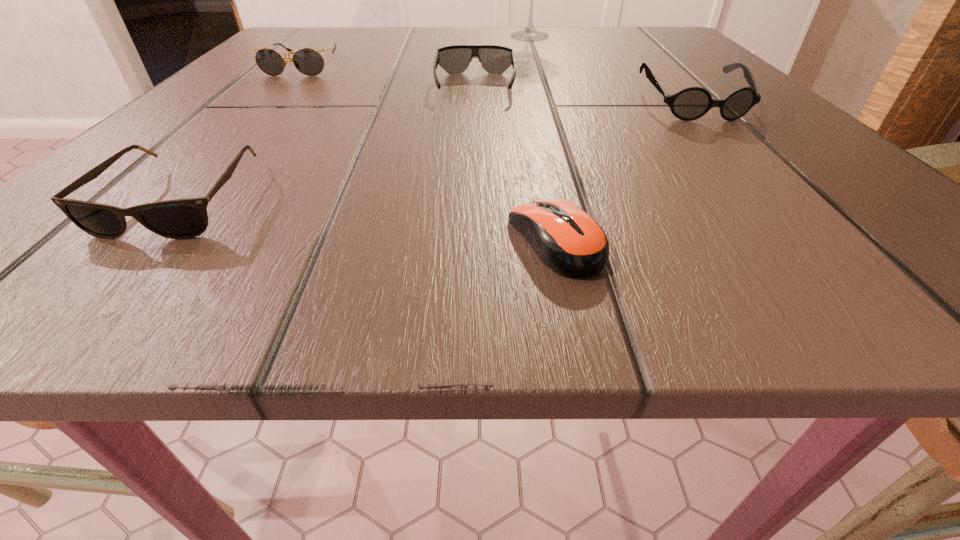
Image resolution: width=960 pixels, height=540 pixels. In order to click on the fourth closest object to the rightmost sunglasses in this screenshot , I will do `click(308, 61)`.

At what (x,y) coordinates should I click in order to perform the action: click on sunglasses that can be found as the third closest to the rightmost object. Please return your answer as a coordinate pair (x, y). Image resolution: width=960 pixels, height=540 pixels. Looking at the image, I should click on (187, 218).

Locate an element on the screen. the closest sunglasses to the computer mouse is located at coordinates (691, 103).

Where is `vacant region that satisfies the following two spatial constraints: 1. on the back side of the tallest object; 2. on the left side of the computer mouse`? vacant region that satisfies the following two spatial constraints: 1. on the back side of the tallest object; 2. on the left side of the computer mouse is located at coordinates (513, 36).